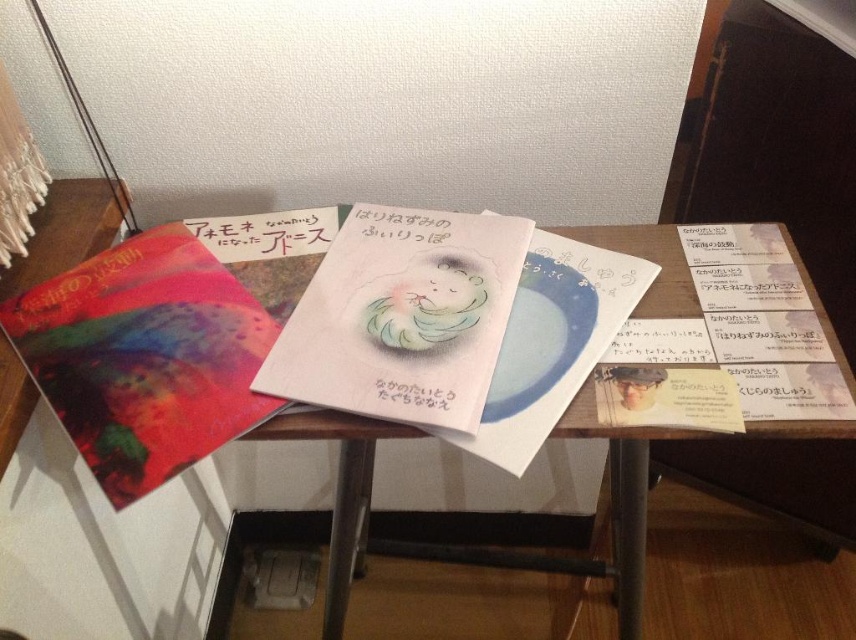
You are organizing a display on the table and need to place a new item between the matte paper postcard at center and the black paper at center. What is the minimum width this new item should have to fit snugly between them without overlapping?

The minimum width should be 4.88 inches to fit snugly between the matte paper postcard at center and the black paper at center without overlapping.

You are organizing items on the wooden table at center and notice the white paper at center. Which item takes up more space on the table?

The wooden table at center is larger in size than the white paper at center, so the wooden table at center takes up more space on the table.